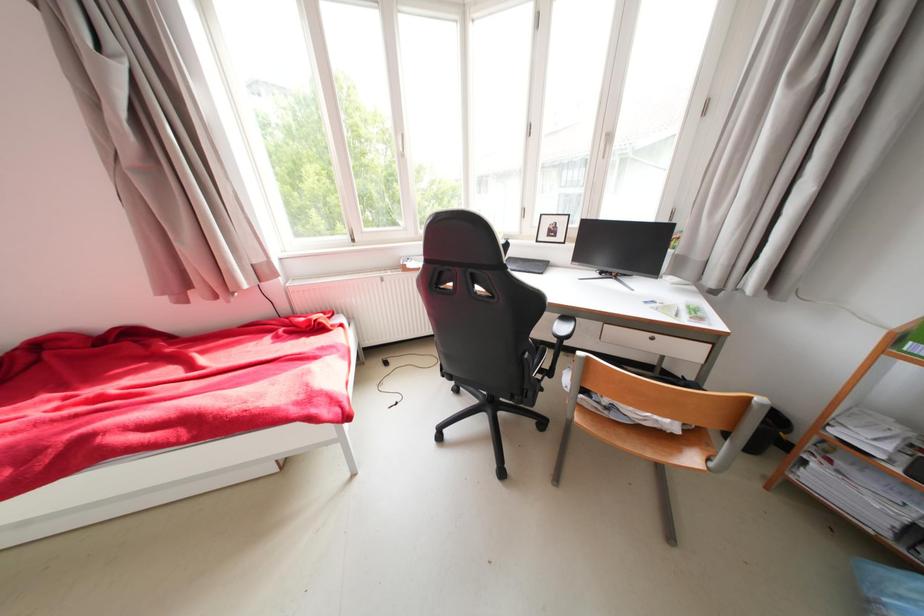
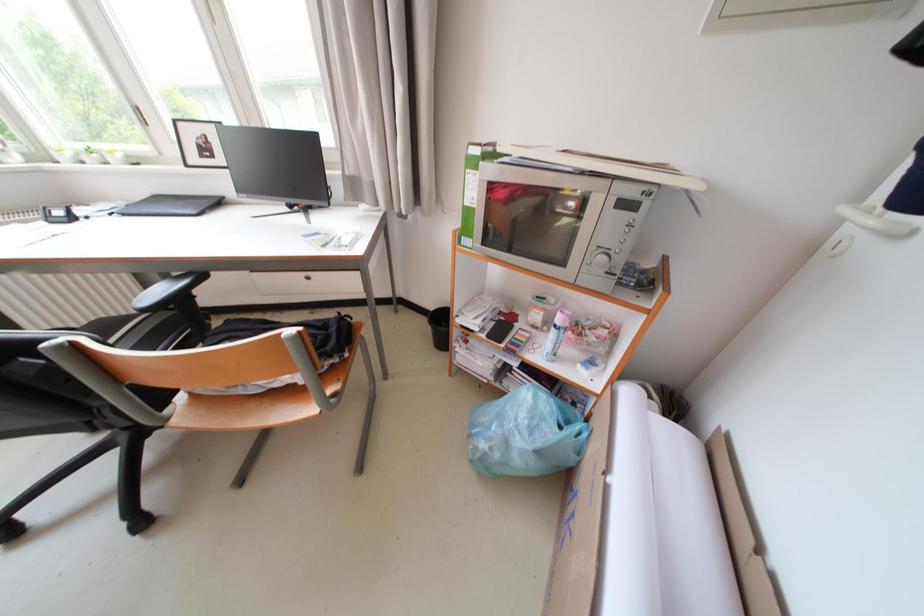
Question: The camera is either moving clockwise (left) or counter-clockwise (right) around the object. The first image is from the beginning of the video and the second image is from the end. Is the camera moving left or right when shooting the video?

Choices:
 (A) Left
 (B) Right

Answer: (A)